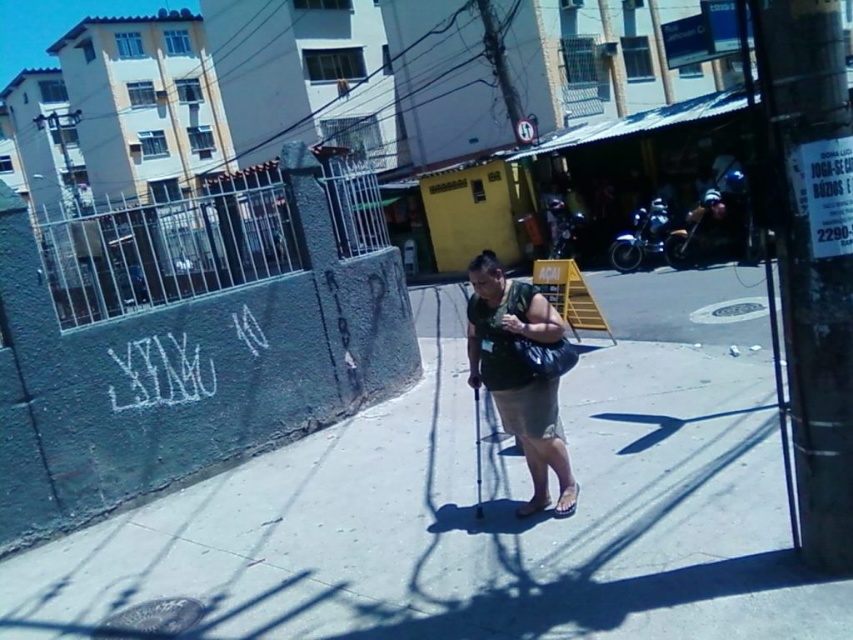
Which is above, metallic silver gate at upper left or smooth black ski pole at center?

metallic silver gate at upper left

Between point (222, 218) and point (477, 512), which one is positioned in front?

Point (477, 512)

The height and width of the screenshot is (640, 853). What are the coordinates of `metallic silver gate at upper left` in the screenshot? It's located at (172, 248).

Is metallic silver gate at upper left to the right of brown leather sandal at lower right from the viewer's perspective?

Incorrect, metallic silver gate at upper left is not on the right side of brown leather sandal at lower right.

Between metallic silver gate at upper left and brown leather sandal at lower right, which one has less height?

brown leather sandal at lower right is shorter.

Between point (280, 266) and point (567, 513), which one is positioned in front?

Point (567, 513)

You are a GUI agent. You are given a task and a screenshot of the screen. Output one action in this format:
    pyautogui.click(x=<x>, y=<y>)
    Task: Click on the metallic silver gate at upper left
    The width and height of the screenshot is (853, 640).
    Given the screenshot: What is the action you would take?
    pyautogui.click(x=172, y=248)

Who is more distant from viewer, (560, 627) or (518, 435)?

Positioned behind is point (518, 435).

Which is in front, point (665, 422) or point (514, 396)?

Point (514, 396) is in front.

Find the location of a particular element. gray concrete pavement at center is located at coordinates (486, 506).